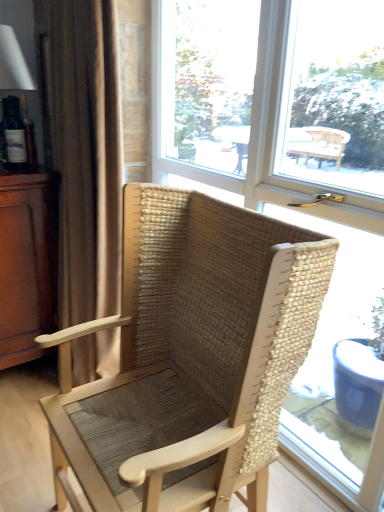
Question: Looking at the image, does natural woven wood chair at center seem bigger or smaller compared to transparent glass window at center?

Choices:
 (A) big
 (B) small

Answer: (A)

Question: In terms of width, does natural woven wood chair at center look wider or thinner when compared to transparent glass window at center?

Choices:
 (A) wide
 (B) thin

Answer: (A)

Question: Estimate the real-world distances between objects in this image. Which object is farther from the brown wood dresser at left?

Choices:
 (A) transparent glass window at center
 (B) brown fabric curtain at left
 (C) natural woven wood chair at center
 (D) matte white table lamp at left

Answer: (C)

Question: Estimate the real-world distances between objects in this image. Which object is farther from the transparent glass window at center?

Choices:
 (A) matte white table lamp at left
 (B) natural woven wood chair at center
 (C) brown wood dresser at left
 (D) brown fabric curtain at left

Answer: (A)